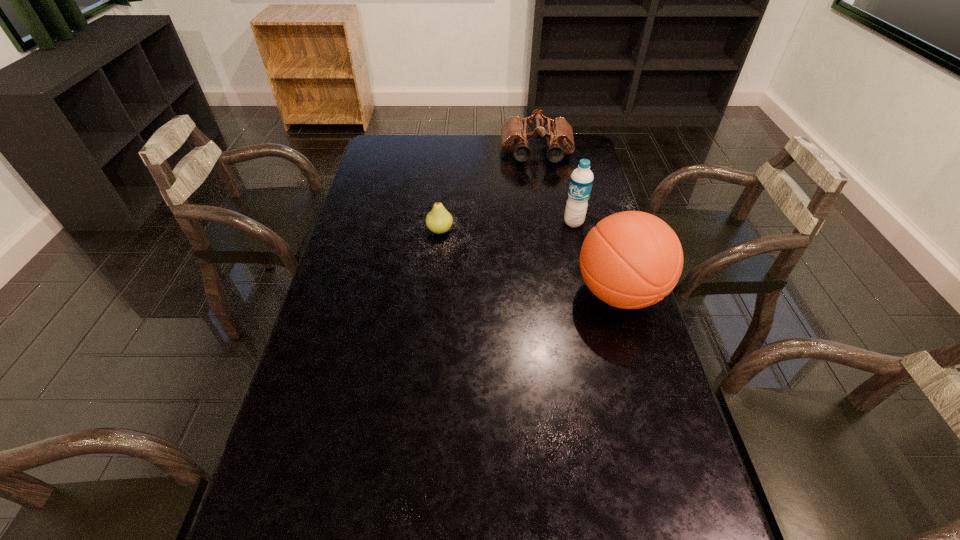
This screenshot has width=960, height=540. What are the coordinates of `the leftmost object` in the screenshot? It's located at coord(438,220).

Where is `the nearest object`? This screenshot has width=960, height=540. the nearest object is located at coordinates (632, 259).

The width and height of the screenshot is (960, 540). Find the location of `water bottle`. water bottle is located at coordinates (581, 180).

Identify the location of binoculars. The height and width of the screenshot is (540, 960). (515, 135).

Image resolution: width=960 pixels, height=540 pixels. What are the coordinates of `vacant space located on the left of the pear` in the screenshot? It's located at (379, 231).

Where is `vacant space located on the front of the basketball`? This screenshot has height=540, width=960. vacant space located on the front of the basketball is located at coordinates (639, 361).

What are the coordinates of `vacant space located on the label of the water bottle` in the screenshot? It's located at (512, 256).

I want to click on vacant space situated 0.090m on the label of the water bottle, so click(546, 237).

This screenshot has height=540, width=960. In order to click on free space located 0.200m on the label of the water bottle in this screenshot , I will do `click(521, 251)`.

At what (x,y) coordinates should I click in order to perform the action: click on blank space located 0.090m through the eyepieces of the farthest object. Please return your answer as a coordinate pair (x, y). The width and height of the screenshot is (960, 540). Looking at the image, I should click on (539, 181).